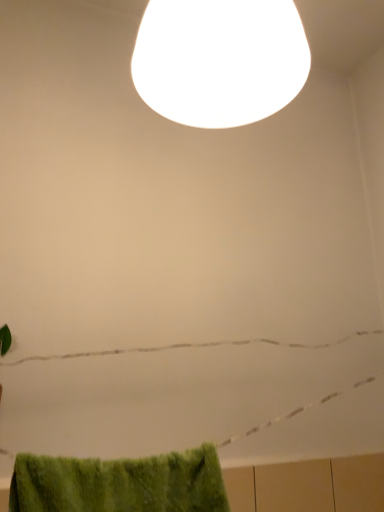
Question: Should I look upward or downward to see white glossy lampshade at upper center?

Choices:
 (A) up
 (B) down

Answer: (A)

Question: Is green fuzzy bath towel at lower left completely or partially outside of white glossy lampshade at upper center?

Choices:
 (A) no
 (B) yes

Answer: (B)

Question: Is the depth of green fuzzy bath towel at lower left less than that of white glossy lampshade at upper center?

Choices:
 (A) no
 (B) yes

Answer: (A)

Question: From a real-world perspective, is green fuzzy bath towel at lower left positioned under white glossy lampshade at upper center based on gravity?

Choices:
 (A) yes
 (B) no

Answer: (A)

Question: Can you confirm if green fuzzy bath towel at lower left is shorter than white glossy lampshade at upper center?

Choices:
 (A) yes
 (B) no

Answer: (A)

Question: Considering the relative positions of green fuzzy bath towel at lower left and white glossy lampshade at upper center in the image provided, is green fuzzy bath towel at lower left behind white glossy lampshade at upper center?

Choices:
 (A) yes
 (B) no

Answer: (A)

Question: Is green fuzzy bath towel at lower left aimed at white glossy lampshade at upper center?

Choices:
 (A) yes
 (B) no

Answer: (B)

Question: Is white glossy lampshade at upper center positioned in front of green fuzzy bath towel at lower left?

Choices:
 (A) yes
 (B) no

Answer: (A)

Question: Could you tell me if white glossy lampshade at upper center is facing green fuzzy bath towel at lower left?

Choices:
 (A) yes
 (B) no

Answer: (B)

Question: Can you confirm if white glossy lampshade at upper center is wider than green fuzzy bath towel at lower left?

Choices:
 (A) yes
 (B) no

Answer: (A)

Question: Is white glossy lampshade at upper center at the left side of green fuzzy bath towel at lower left?

Choices:
 (A) no
 (B) yes

Answer: (A)

Question: From the image's perspective, is white glossy lampshade at upper center located above green fuzzy bath towel at lower left?

Choices:
 (A) yes
 (B) no

Answer: (A)

Question: Does white glossy lampshade at upper center have a smaller size compared to green fuzzy bath towel at lower left?

Choices:
 (A) no
 (B) yes

Answer: (A)

Question: Considering their positions, is green fuzzy bath towel at lower left located in front of or behind white glossy lampshade at upper center?

Choices:
 (A) front
 (B) behind

Answer: (B)